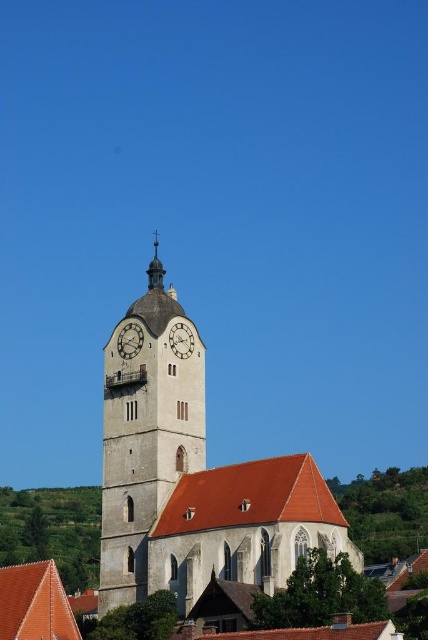
In the scene shown: Can you confirm if matte gray clock at upper center is bigger than metallic clock face at center?

Incorrect, matte gray clock at upper center is not larger than metallic clock face at center.

Does matte gray clock at upper center lie in front of metallic clock face at center?

No.

Where is `matte gray clock at upper center`? The image size is (428, 640). matte gray clock at upper center is located at coordinates (130, 340).

Does white stone clock tower at center have a greater height compared to gold textured cross at upper center?

Yes.

Looking at this image, is white stone clock tower at center above gold textured cross at upper center?

No.

Who is more forward, [119,602] or [154,282]?

Point [119,602] is in front.

The width and height of the screenshot is (428, 640). Identify the location of white stone clock tower at center. (145, 440).

Is point (124, 426) positioned after point (151, 266)?

No, (124, 426) is closer to viewer.

Which of these two, matte stone church at center or gold textured cross at upper center, stands taller?

matte stone church at center is taller.

Which is in front, point (104, 380) or point (157, 269)?

Point (157, 269)

At what (x,y) coordinates should I click in order to perform the action: click on matte stone church at center. Please return your answer as a coordinate pair (x, y). This screenshot has height=640, width=428. Looking at the image, I should click on (193, 483).